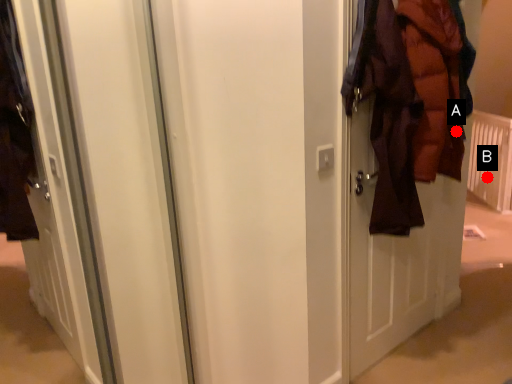
Question: Two points are circled on the image, labeled by A and B beside each circle. Which of the following is the closest to the observer?

Choices:
 (A) A is closer
 (B) B is closer

Answer: (A)